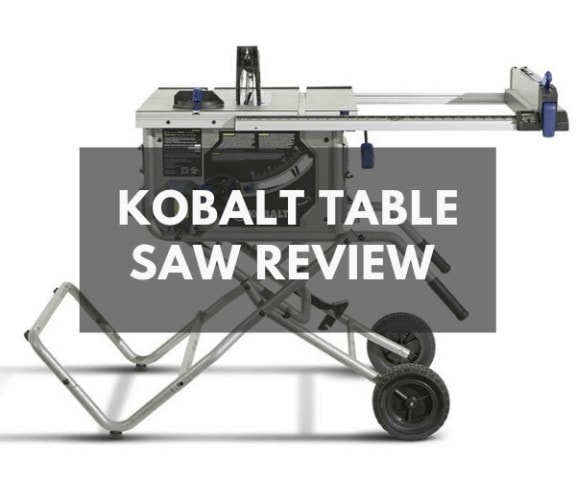
The width and height of the screenshot is (576, 480). I want to click on black lever under top of table saw, right of center, so click(x=367, y=147).